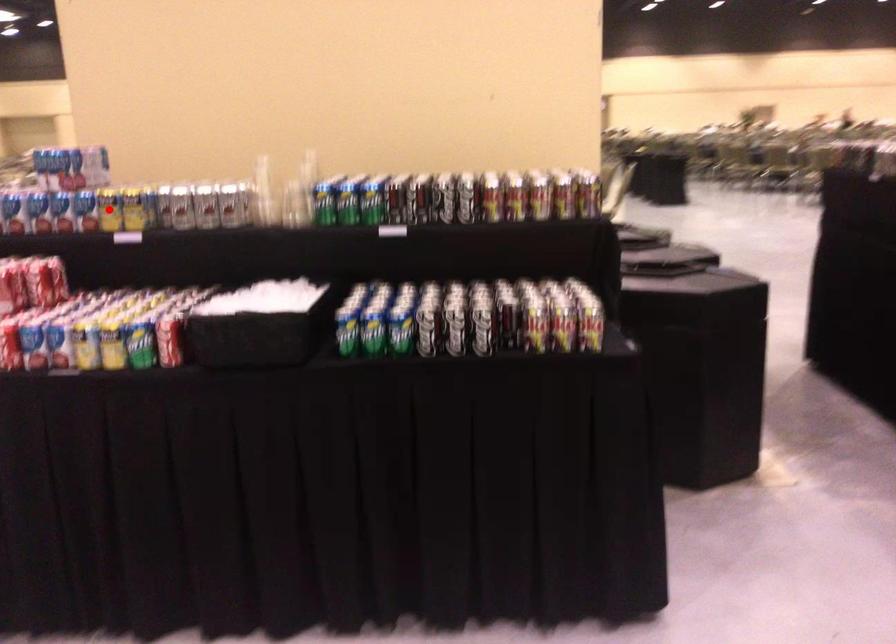
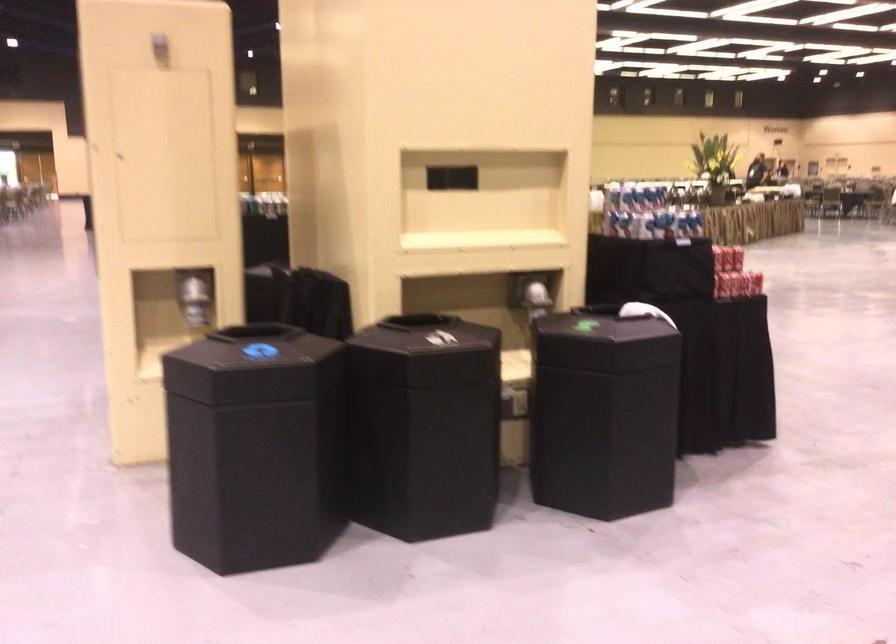
Question: I am providing you with two images of the same scene from different viewpoints. A red point is marked on the first image. At the location where the point appears in image 1, is it still visible in image 2?

Choices:
 (A) Yes
 (B) No

Answer: (B)